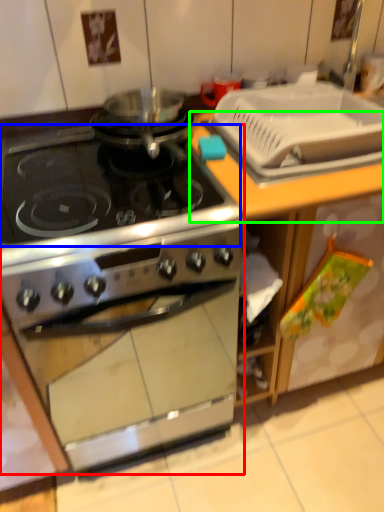
Question: Which object is the farthest from kitchen appliance (highlighted by a red box)? Choose among these: gas stove (highlighted by a blue box) or counter top (highlighted by a green box).

Choices:
 (A) gas stove
 (B) counter top

Answer: (B)